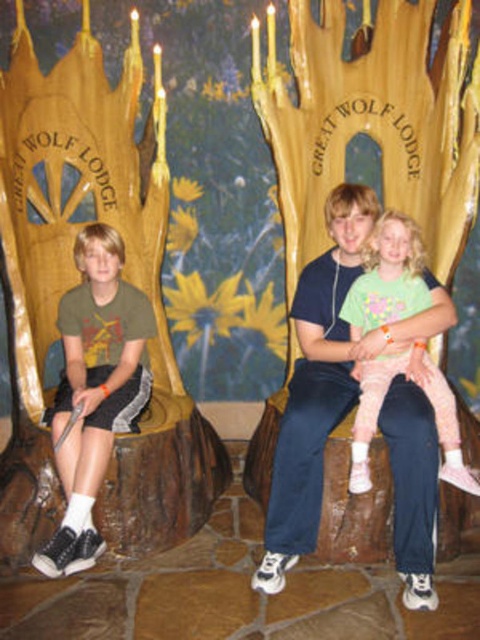
Question: Which point is closer to the camera?

Choices:
 (A) pink fabric pants at center
 (B) light green cotton shirt at center
 (C) matte green t-shirt at left

Answer: (C)

Question: Based on their relative distances, which object is farther from the matte green t-shirt at left?

Choices:
 (A) light green cotton shirt at center
 (B) pink fabric pants at center

Answer: (B)

Question: Is matte green t-shirt at left smaller than pink fabric pants at center?

Choices:
 (A) no
 (B) yes

Answer: (A)

Question: Is matte green t-shirt at left further to the viewer compared to pink fabric pants at center?

Choices:
 (A) yes
 (B) no

Answer: (B)

Question: Where is light green cotton shirt at center located in relation to pink fabric pants at center in the image?

Choices:
 (A) left
 (B) right

Answer: (A)

Question: Which point is closer to the camera?

Choices:
 (A) pink fabric pants at center
 (B) light green cotton shirt at center
 (C) matte green t-shirt at left

Answer: (C)